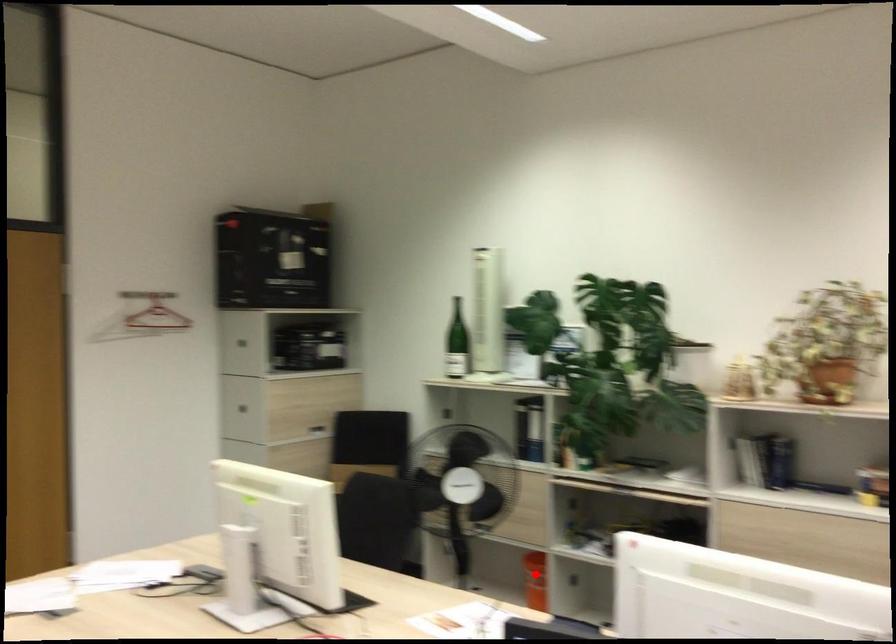
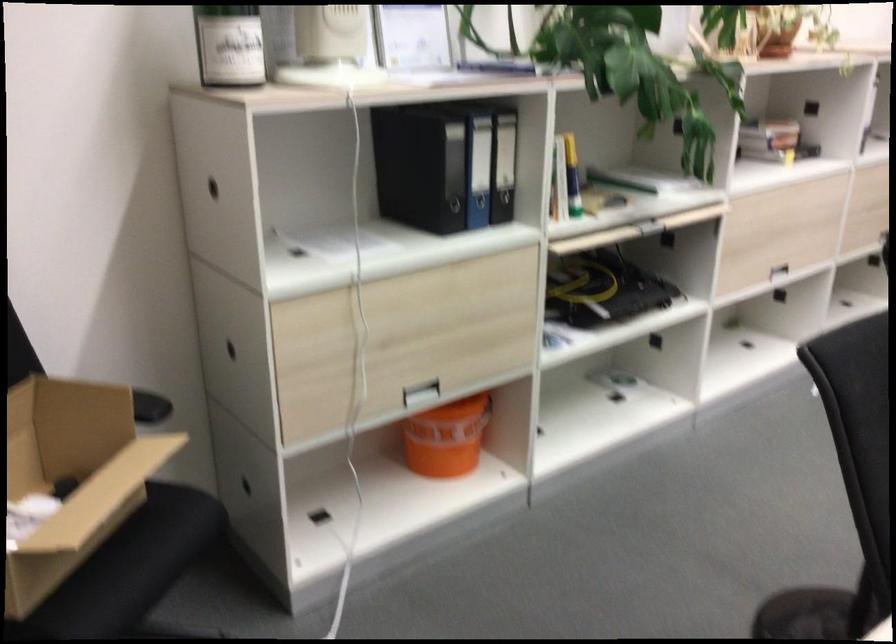
Question: I am providing you with two images of the same scene from different viewpoints. Given a red point in image1, look at the same physical point in image2. Is it:

Choices:
 (A) Closer to the viewpoint
 (B) Farther from the viewpoint

Answer: (A)